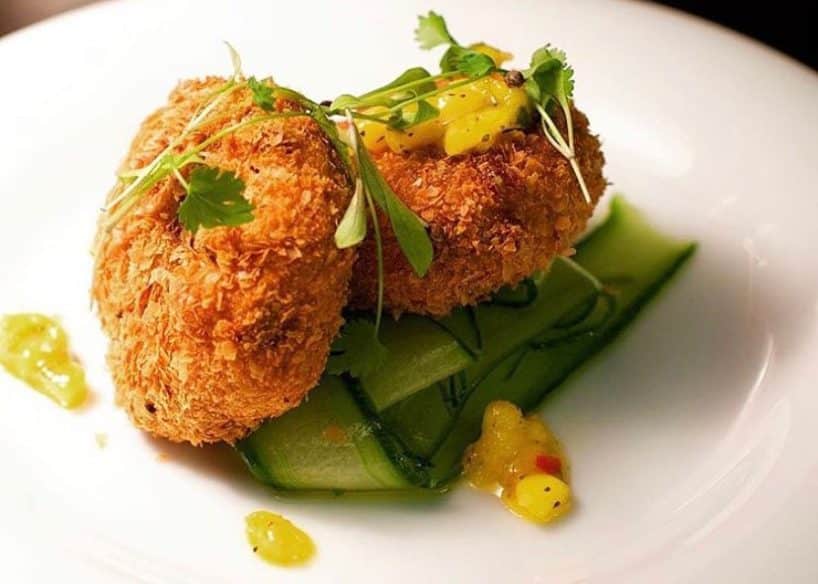
Identify the location of soft shadow on plate. The width and height of the screenshot is (818, 584). (688, 322).